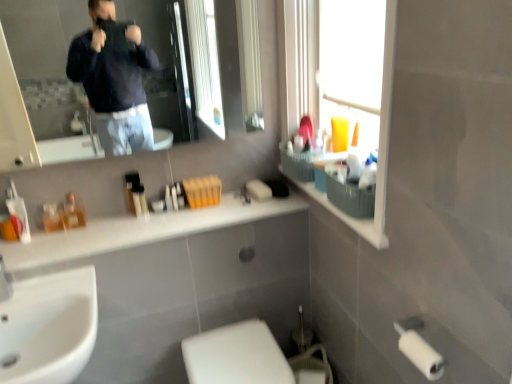
Locate an element on the screen. This screenshot has width=512, height=384. vacant region to the right of translucent glass perfume at center, the second toiletry positioned from the left is located at coordinates (112, 225).